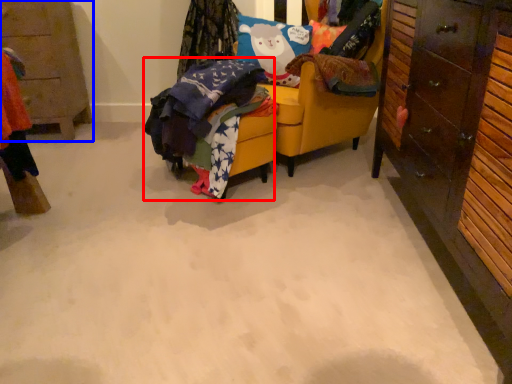
Question: Which object is closer to the camera taking this photo, clothing (highlighted by a red box) or cabinetry (highlighted by a blue box)?

Choices:
 (A) clothing
 (B) cabinetry

Answer: (A)